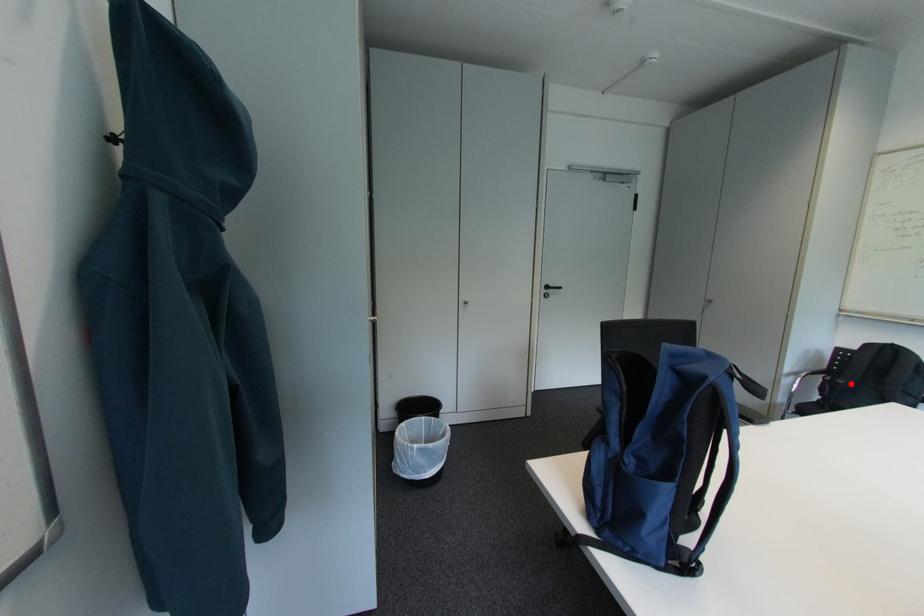
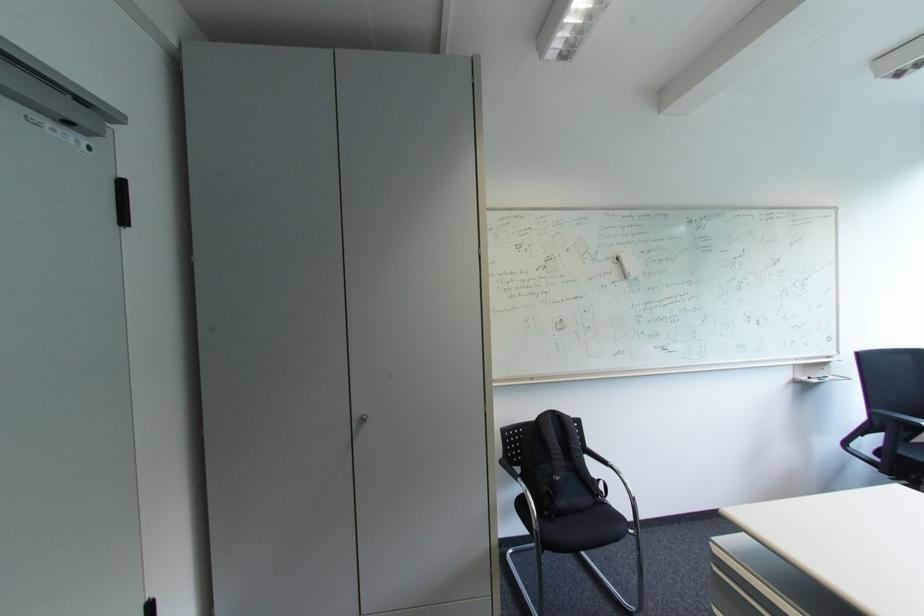
Question: I am providing you with two images of the same scene from different viewpoints. Image1 has a red point marked. In image2, the corresponding 3D location appears at what relative position? Reply with the corresponding letter.

Choices:
 (A) Closer
 (B) Farther

Answer: (B)